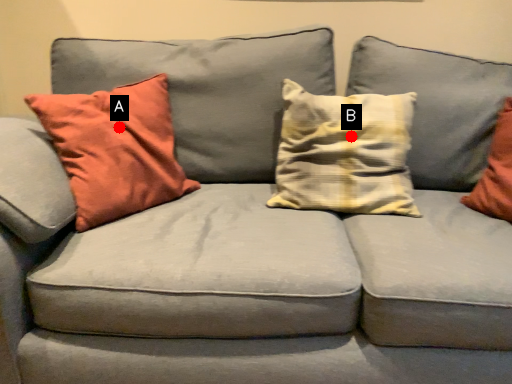
Question: Two points are circled on the image, labeled by A and B beside each circle. Which of the following is the farthest from the observer?

Choices:
 (A) A is further
 (B) B is further

Answer: (B)